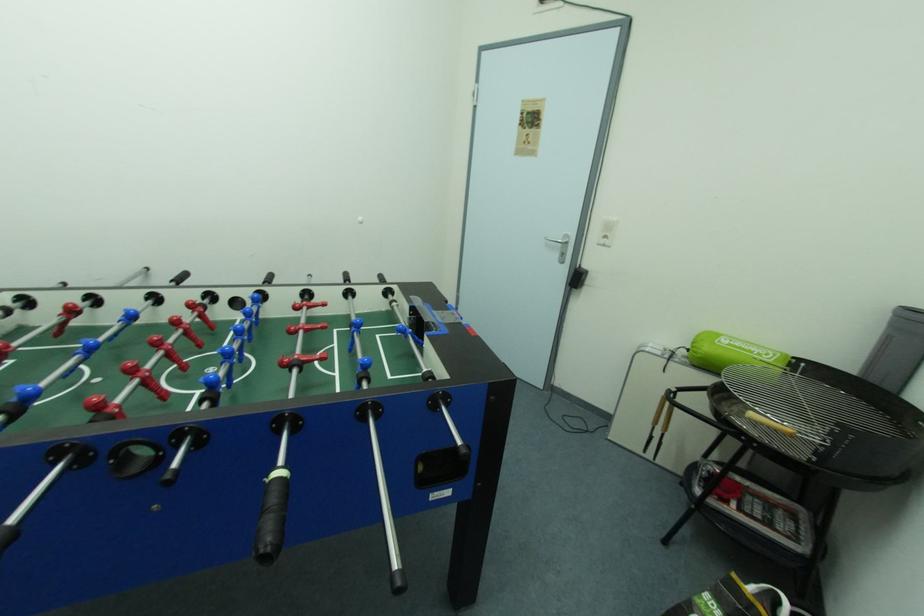
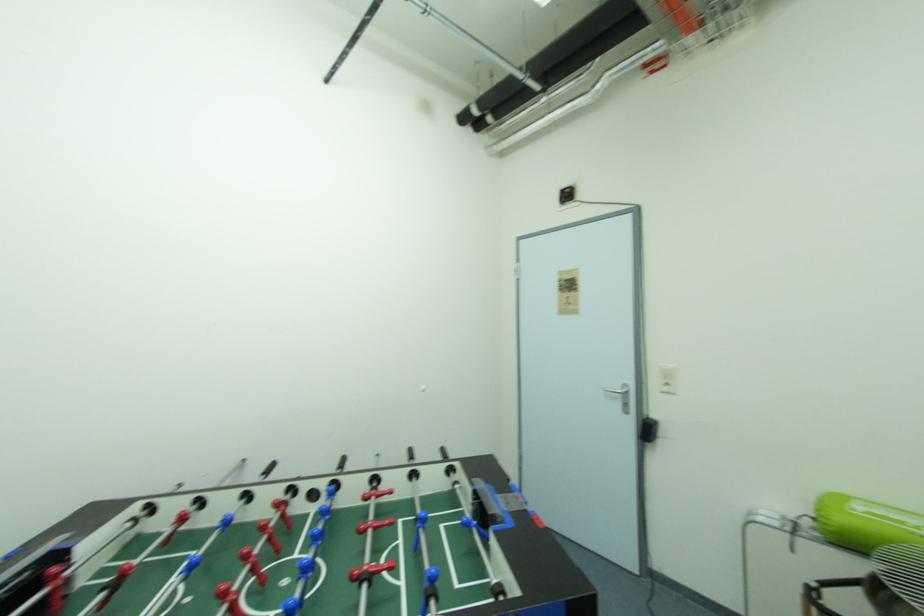
Question: Based on the continuous images, in which direction is the camera rotating? Reply with the corresponding letter.

Choices:
 (A) Left
 (B) Right
 (C) Up
 (D) Down

Answer: (C)